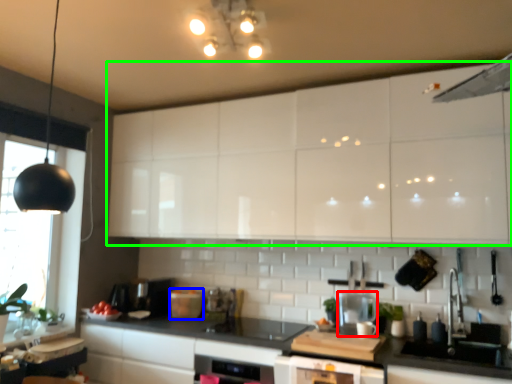
Question: Estimate the real-world distances between objects in this image. Which object is closer to appliance (highlighted by a red box), appliance (highlighted by a blue box) or cabinetry (highlighted by a green box)?

Choices:
 (A) appliance
 (B) cabinetry

Answer: (B)